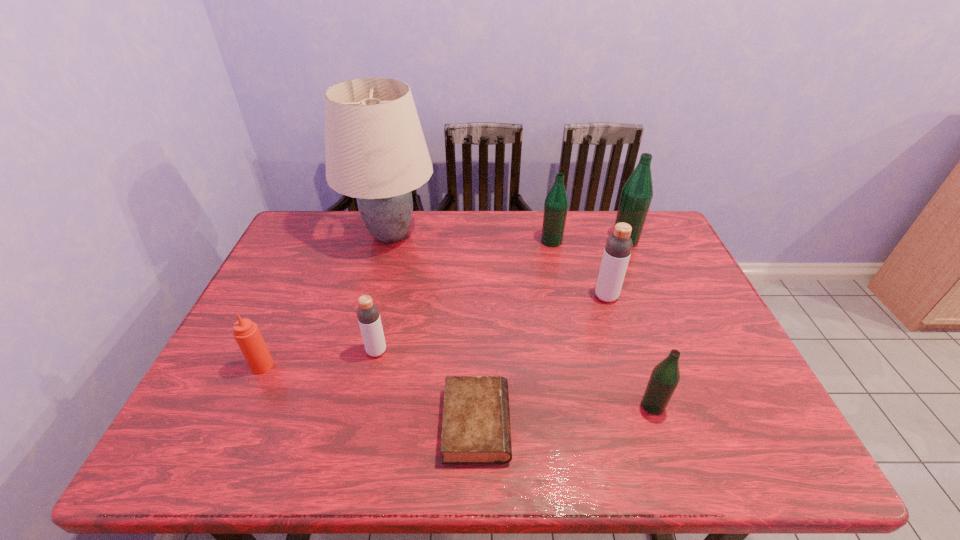
This screenshot has height=540, width=960. What are the coordinates of `the tallest object` in the screenshot? It's located at (375, 149).

Locate an element on the screen. lampshade is located at coordinates (375, 149).

Where is `the tallest bottle`? the tallest bottle is located at coordinates (637, 193).

I want to click on the rightmost bottle, so click(637, 193).

Identify the location of the fourth bottle from right to left. This screenshot has height=540, width=960. (556, 203).

Identify the location of the second biggest green bottle. This screenshot has width=960, height=540. (556, 203).

In order to click on the farther gray bottle in this screenshot , I will do `click(618, 247)`.

I want to click on the right gray bottle, so click(x=618, y=247).

You are a GUI agent. You are given a task and a screenshot of the screen. Output one action in this format:
    pyautogui.click(x=<x>, y=<y>)
    Task: Click on the nearer gray bottle
    Image resolution: width=960 pixels, height=540 pixels.
    Given the screenshot: What is the action you would take?
    pyautogui.click(x=368, y=315)

Where is `the left gray bottle`? This screenshot has width=960, height=540. the left gray bottle is located at coordinates (368, 315).